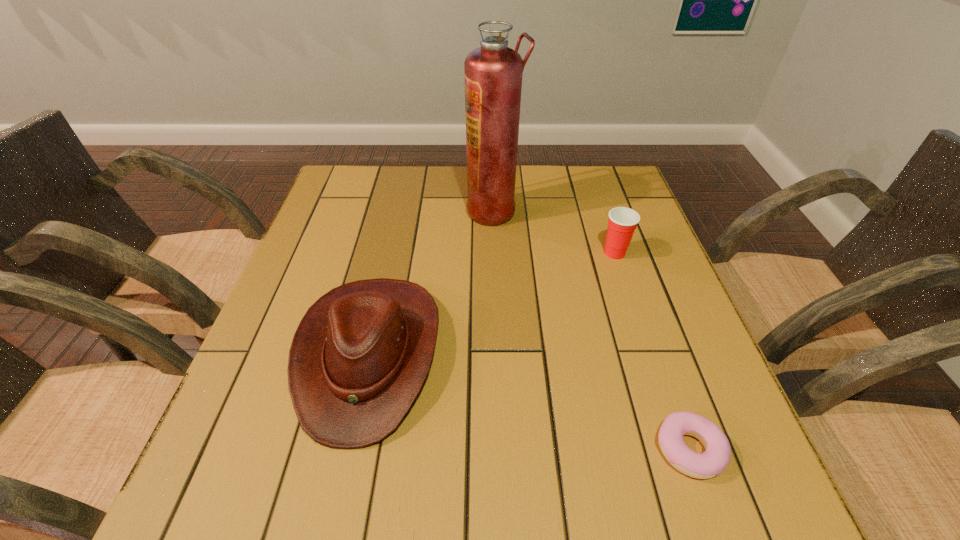
Locate an element on the screen. vacant area in the image that satisfies the following two spatial constraints: 1. on the back side of the Dixie cup; 2. on the side of the tallest object with the label is located at coordinates (601, 211).

In order to click on free space in the image that satisfies the following two spatial constraints: 1. on the front-facing side of the leftmost object; 2. on the right side of the shortest object in this screenshot , I will do `click(348, 449)`.